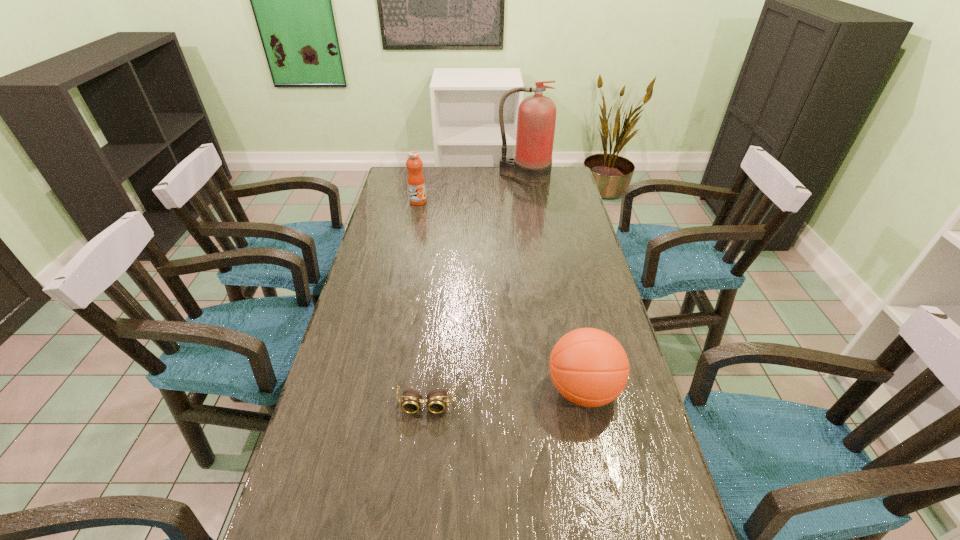
Locate an element on the screen. vacant area that satisfies the following two spatial constraints: 1. at the nozzle of the basketball; 2. on the right side of the fire extinguisher is located at coordinates (557, 390).